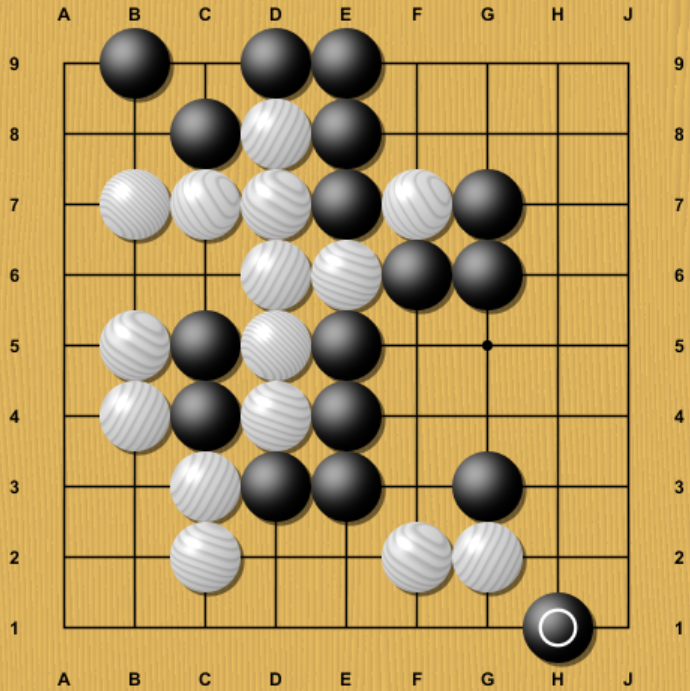
Where is `letters across the top of the board`? The height and width of the screenshot is (691, 690). letters across the top of the board is located at coordinates (61, 14), (134, 12), (206, 10), (273, 12), (344, 9), (420, 10), (489, 10), (558, 9), (626, 12).